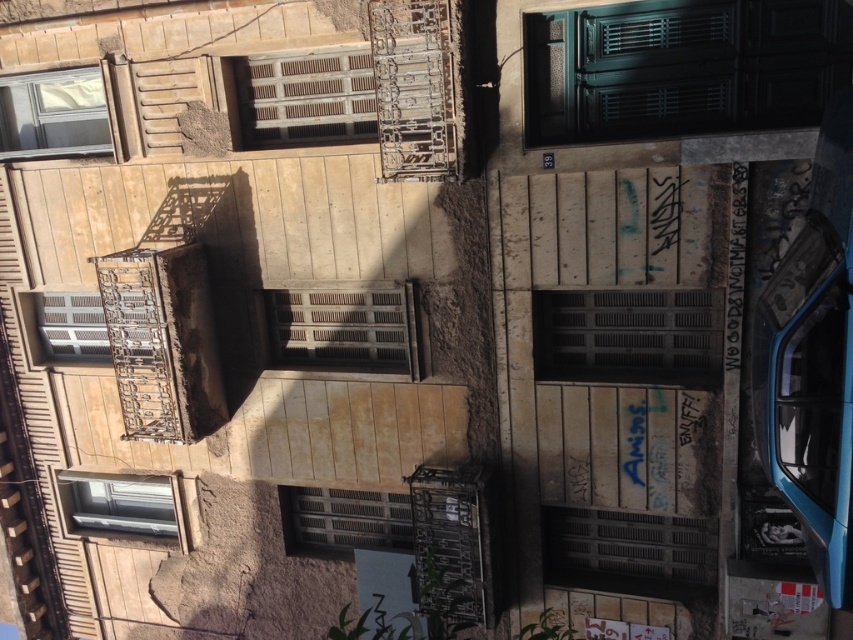
Question: Estimate the real-world distances between objects in this image. Which object is closer to the matte glass window at lower left?

Choices:
 (A) brown wooden window at center
 (B) matte glass window at upper left
 (C) wooden at center
 (D) matte white window at left

Answer: (D)

Question: Which point appears closest to the camera in this image?

Choices:
 (A) (65, 76)
 (B) (654, 540)
 (C) (563, 120)
 (D) (619, 378)

Answer: (C)

Question: From the image, what is the correct spatial relationship of brown wooden shutter at center in relation to matte white window at left?

Choices:
 (A) right
 (B) left

Answer: (A)

Question: Is matte glass window at upper left closer to camera compared to matte white window at left?

Choices:
 (A) no
 (B) yes

Answer: (B)

Question: In this image, where is green matte door at center located relative to brown wooden window at center?

Choices:
 (A) above
 (B) below

Answer: (A)

Question: Which of the following is the farthest from the observer?

Choices:
 (A) green matte door at center
 (B) matte glass window at lower left
 (C) matte glass window at upper left

Answer: (B)